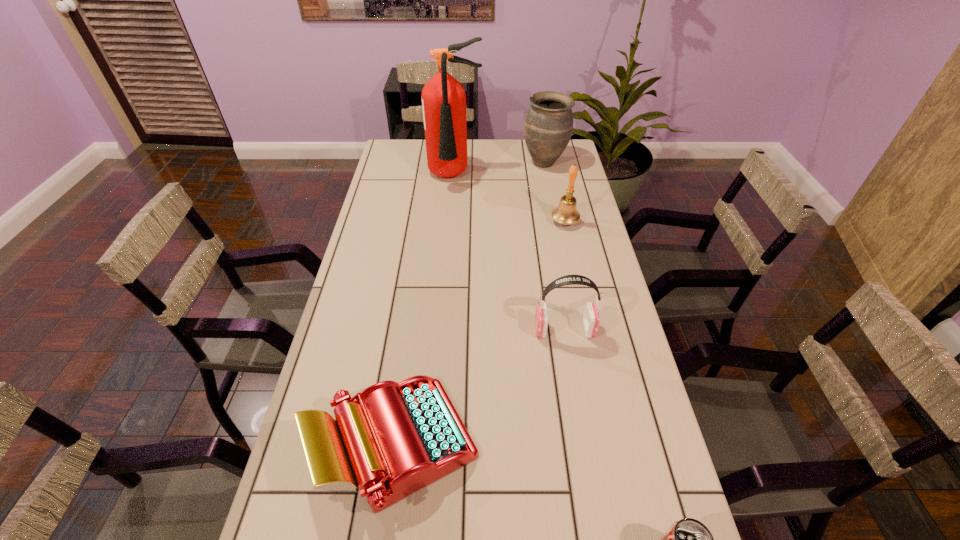
Where is `unoccupied position between the urn and the third nearest object`? unoccupied position between the urn and the third nearest object is located at coordinates point(554,246).

The height and width of the screenshot is (540, 960). In order to click on the closest object relative to the urn in this screenshot , I will do `click(443, 98)`.

Choose which object is the nearest neighbor to the second shortest object. Please provide its 2D coordinates. Your answer should be formatted as a tuple, i.e. [(x, y)], where the tuple contains the x and y coordinates of a point satisfying the conditions above.

[(591, 319)]

Identify the location of free location that satisfies the following two spatial constraints: 1. at the nozzle of the tallest object; 2. on the typing side of the fifth farthest object. This screenshot has width=960, height=540. (435, 444).